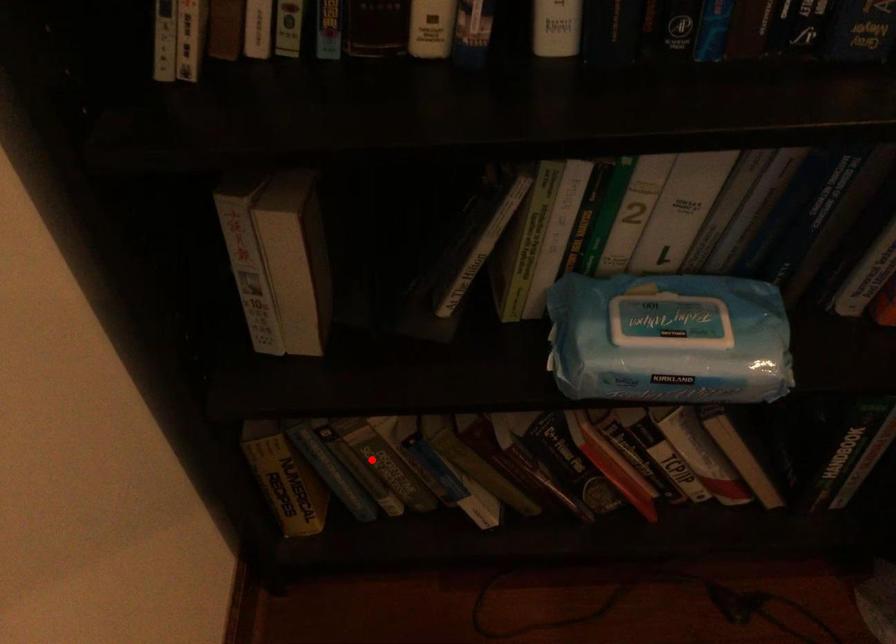
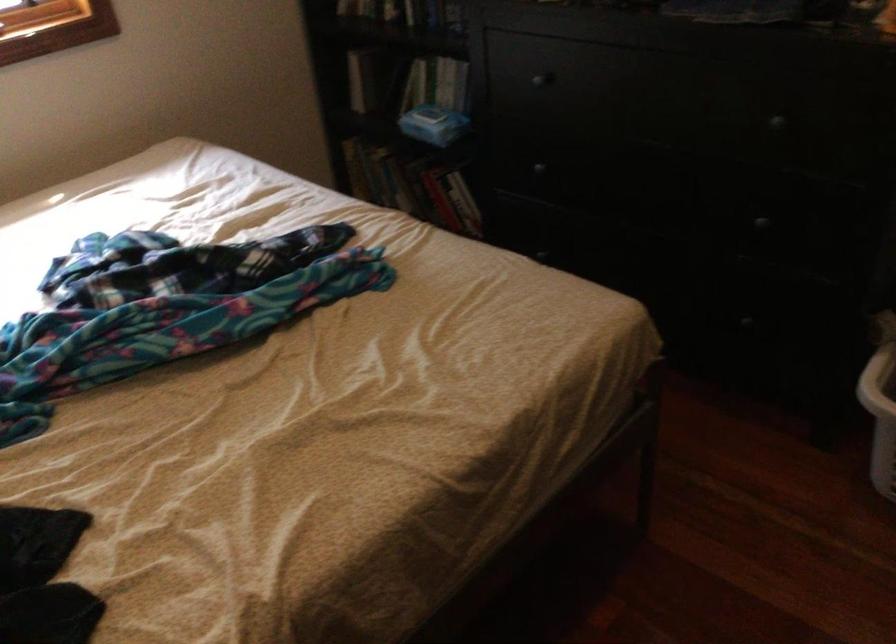
Where in the second image is the point corresponding to the highlighted location from the first image?

(380, 175)